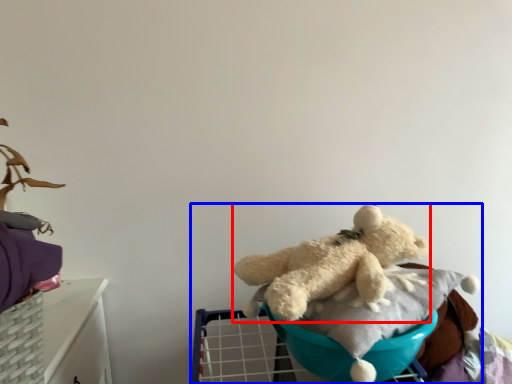
Question: Which object is further to the camera taking this photo, teddy bear (highlighted by a red box) or baby carriage (highlighted by a blue box)?

Choices:
 (A) teddy bear
 (B) baby carriage

Answer: (A)